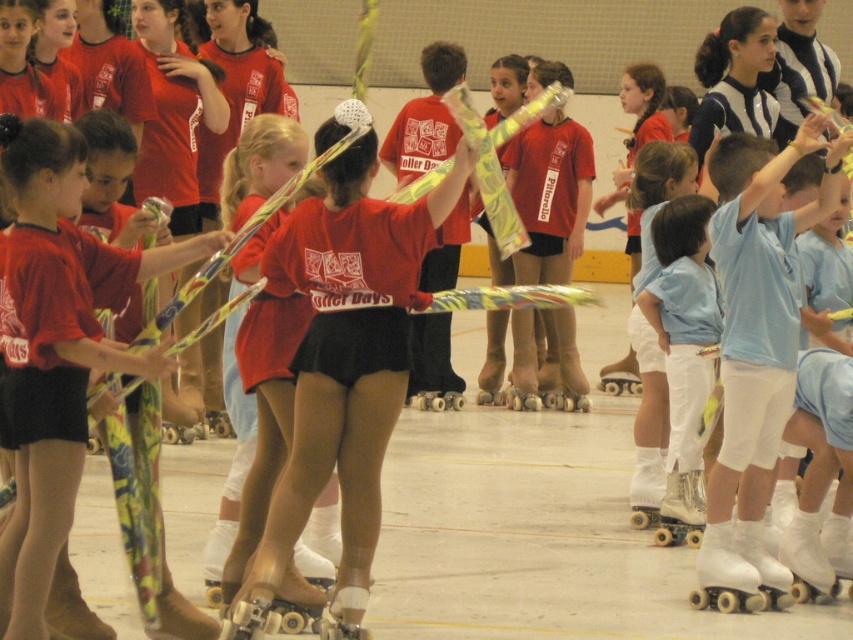
You are a GUI agent. You are given a task and a screenshot of the screen. Output one action in this format:
    pyautogui.click(x=<x>, y=<y>)
    Task: Click on the white matte shorts at right
    The image size is (853, 640).
    Given the screenshot: What is the action you would take?
    pyautogui.click(x=756, y=346)

Who is taller, white matte shorts at right or white rubber roller skate at lower right?

With more height is white matte shorts at right.

Which is behind, point (751, 422) or point (701, 552)?

Point (701, 552)

Where is `white matte shorts at right`? The height and width of the screenshot is (640, 853). white matte shorts at right is located at coordinates (756, 346).